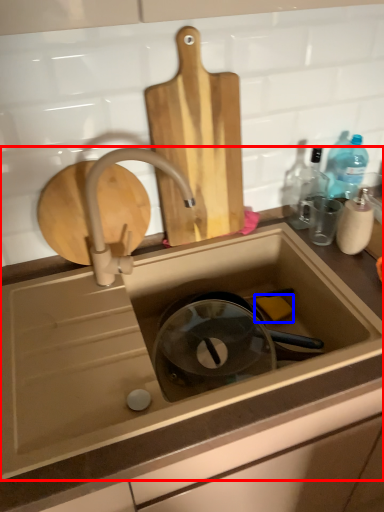
Question: Which of the following is the closest to the observer, sink (highlighted by a red box) or soap (highlighted by a blue box)?

Choices:
 (A) sink
 (B) soap

Answer: (A)